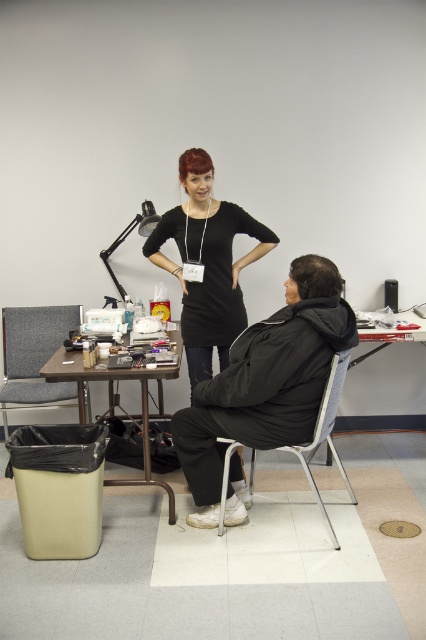
Which is below, gray fabric chair at left or metallic silver chair at lower center?

metallic silver chair at lower center is lower down.

Is gray fabric chair at left further to camera compared to metallic silver chair at lower center?

Yes, gray fabric chair at left is behind metallic silver chair at lower center.

Identify the location of gray fabric chair at left. This screenshot has width=426, height=640. (34, 356).

Based on the photo, between matte black jacket at center and dark brown hair at right, which one has less height?

Standing shorter between the two is dark brown hair at right.

Can you confirm if matte black jacket at center is positioned to the left of dark brown hair at right?

Correct, you'll find matte black jacket at center to the left of dark brown hair at right.

Does point (187, 481) come behind point (310, 273)?

Yes, point (187, 481) is behind point (310, 273).

Identify the location of matte black jacket at center. (265, 381).

Is black matte dress at center thinner than metallic silver chair at lower center?

No, black matte dress at center is not thinner than metallic silver chair at lower center.

Does black matte dress at center have a greater width compared to metallic silver chair at lower center?

Yes.

This screenshot has height=640, width=426. Find the location of `black matte dress at center`. black matte dress at center is located at coordinates (207, 262).

This screenshot has height=640, width=426. Identify the location of black matte dress at center. (207, 262).